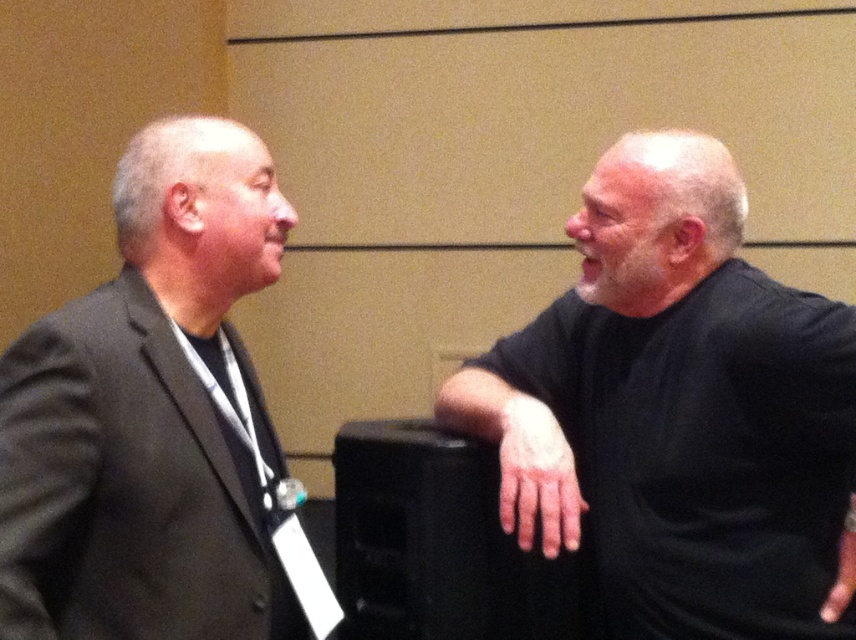
Is the position of pale skin/hair at right less distant than that of matte black hand at right?

No, it is behind matte black hand at right.

Is point (560, 486) behind point (842, 595)?

Yes.

Is point (545, 554) positioned in front of point (835, 609)?

No, (545, 554) is further to viewer.

What are the coordinates of `pale skin/hair at right` in the screenshot? It's located at (536, 476).

Is black matte speaker at right above pale skin/hair at right?

Actually, black matte speaker at right is below pale skin/hair at right.

The width and height of the screenshot is (856, 640). Find the location of `black matte speaker at right`. black matte speaker at right is located at coordinates (437, 541).

Describe the element at coordinates (675, 404) in the screenshot. Image resolution: width=856 pixels, height=640 pixels. I see `black matte shirt at right` at that location.

In the scene shown: Is the position of black matte shirt at right more distant than that of matte black hand at right?

No.

The width and height of the screenshot is (856, 640). In order to click on black matte shirt at right in this screenshot , I will do `click(675, 404)`.

The width and height of the screenshot is (856, 640). Identify the location of black matte shirt at right. (675, 404).